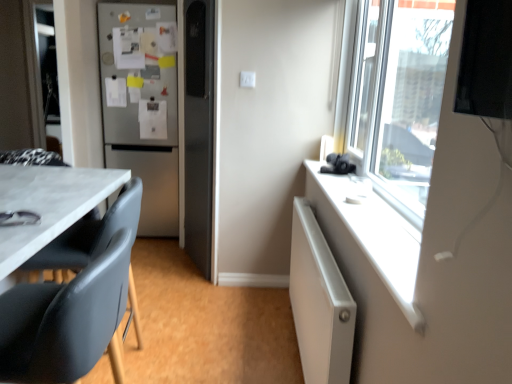
Question: Does black leather chair at lower left appear on the left side of satin silver refrigerator at left?

Choices:
 (A) yes
 (B) no

Answer: (B)

Question: Is black leather chair at lower left further to the viewer compared to satin silver refrigerator at left?

Choices:
 (A) no
 (B) yes

Answer: (A)

Question: From a real-world perspective, is black leather chair at lower left positioned over satin silver refrigerator at left based on gravity?

Choices:
 (A) yes
 (B) no

Answer: (B)

Question: Does black leather chair at lower left have a larger size compared to satin silver refrigerator at left?

Choices:
 (A) yes
 (B) no

Answer: (B)

Question: Is satin silver refrigerator at left inside black leather chair at lower left?

Choices:
 (A) yes
 (B) no

Answer: (B)

Question: Is satin silver refrigerator at left in front of or behind white plastic electric outlet at center in the image?

Choices:
 (A) behind
 (B) front

Answer: (A)

Question: Is satin silver refrigerator at left wider or thinner than white plastic electric outlet at center?

Choices:
 (A) thin
 (B) wide

Answer: (B)

Question: Is point (115, 94) closer or farther from the camera than point (246, 79)?

Choices:
 (A) farther
 (B) closer

Answer: (A)

Question: Considering the relative positions of satin silver refrigerator at left and white plastic electric outlet at center in the image provided, is satin silver refrigerator at left to the left or to the right of white plastic electric outlet at center?

Choices:
 (A) left
 (B) right

Answer: (A)

Question: Is black leather chair at lower left inside the boundaries of white plastic window sill at upper right, or outside?

Choices:
 (A) outside
 (B) inside

Answer: (A)

Question: From a real-world perspective, is black leather chair at lower left above or below white plastic window sill at upper right?

Choices:
 (A) above
 (B) below

Answer: (B)

Question: From their relative heights in the image, would you say black leather chair at lower left is taller or shorter than white plastic window sill at upper right?

Choices:
 (A) short
 (B) tall

Answer: (B)

Question: Considering the positions of point (6, 347) and point (316, 215), is point (6, 347) closer or farther from the camera than point (316, 215)?

Choices:
 (A) farther
 (B) closer

Answer: (B)

Question: From a real-world perspective, is white textured radiator at right physically located above or below white plastic window sill at upper right?

Choices:
 (A) below
 (B) above

Answer: (A)

Question: Considering the positions of white textured radiator at right and white plastic window sill at upper right in the image, is white textured radiator at right taller or shorter than white plastic window sill at upper right?

Choices:
 (A) short
 (B) tall

Answer: (B)